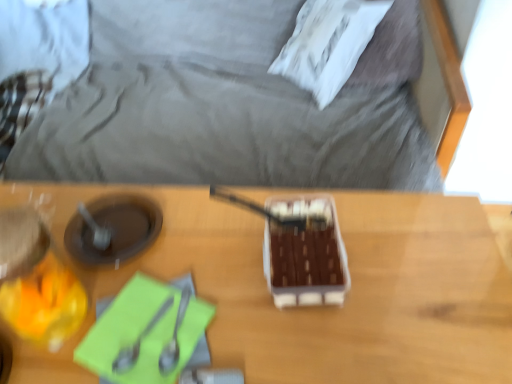
Find the location of a particular element. The height and width of the screenshot is (384, 512). vacant space behind satin silver spoon at lower left, which is the second utensil in right-to-left order is located at coordinates 152,256.